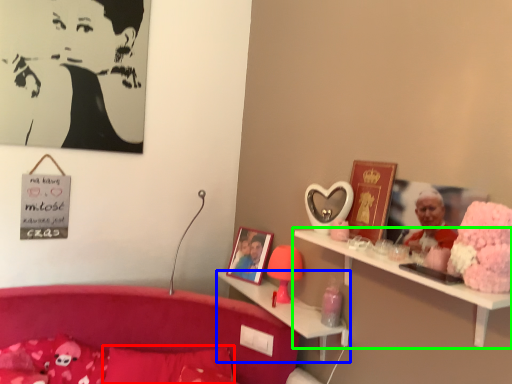
Question: Based on their relative distances, which object is farther from pillow (highlighted by a red box)? Choose from shelf (highlighted by a blue box) and shelf (highlighted by a green box).

Choices:
 (A) shelf
 (B) shelf

Answer: (B)